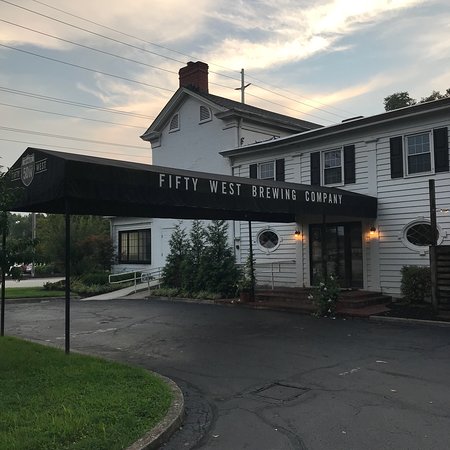
Find the location of a particular element. The width and height of the screenshot is (450, 450). front door is located at coordinates (344, 257).